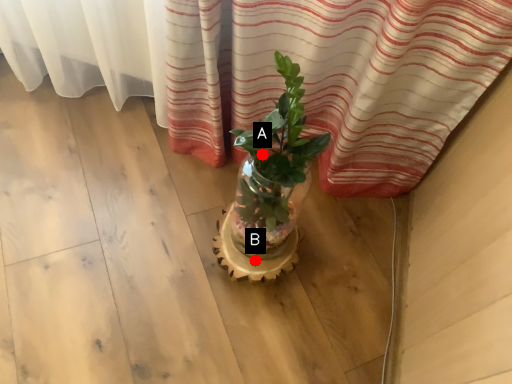
Question: Two points are circled on the image, labeled by A and B beside each circle. Which point is further to the camera?

Choices:
 (A) A is further
 (B) B is further

Answer: (B)